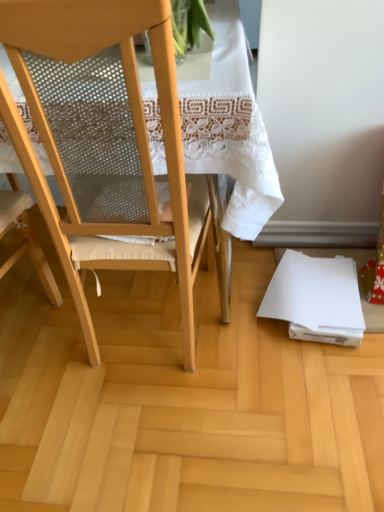
Question: Is white paper at lower right not close to matte wood chair at center?

Choices:
 (A) yes
 (B) no

Answer: (B)

Question: Considering the relative positions of white paper at lower right and matte wood chair at center in the image provided, is white paper at lower right to the right of matte wood chair at center from the viewer's perspective?

Choices:
 (A) no
 (B) yes

Answer: (B)

Question: Is white paper at lower right next to matte wood chair at center and touching it?

Choices:
 (A) no
 (B) yes

Answer: (A)

Question: Is matte wood chair at center at the back of white paper at lower right?

Choices:
 (A) no
 (B) yes

Answer: (A)

Question: Is white paper at lower right located outside matte wood chair at center?

Choices:
 (A) no
 (B) yes

Answer: (B)

Question: In terms of width, does matte wood chair at center look wider or thinner when compared to wooden floor at lower right?

Choices:
 (A) wide
 (B) thin

Answer: (B)

Question: In the image, is matte wood chair at center on the left side or the right side of wooden floor at lower right?

Choices:
 (A) right
 (B) left

Answer: (B)

Question: Looking at the image, does matte wood chair at center seem bigger or smaller compared to wooden floor at lower right?

Choices:
 (A) small
 (B) big

Answer: (B)

Question: In terms of height, does matte wood chair at center look taller or shorter compared to wooden floor at lower right?

Choices:
 (A) tall
 (B) short

Answer: (A)

Question: Is white paper at lower right to the left or to the right of wooden floor at lower right in the image?

Choices:
 (A) left
 (B) right

Answer: (B)

Question: Looking at the image, does white paper at lower right seem bigger or smaller compared to wooden floor at lower right?

Choices:
 (A) small
 (B) big

Answer: (A)

Question: Looking at their shapes, would you say white paper at lower right is wider or thinner than wooden floor at lower right?

Choices:
 (A) thin
 (B) wide

Answer: (A)

Question: From a real-world perspective, is white paper at lower right physically located above or below wooden floor at lower right?

Choices:
 (A) below
 (B) above

Answer: (B)

Question: Considering the positions of matte wood chair at center and white paper at lower right in the image, is matte wood chair at center wider or thinner than white paper at lower right?

Choices:
 (A) thin
 (B) wide

Answer: (B)

Question: Looking at the image, does matte wood chair at center seem bigger or smaller compared to white paper at lower right?

Choices:
 (A) big
 (B) small

Answer: (A)